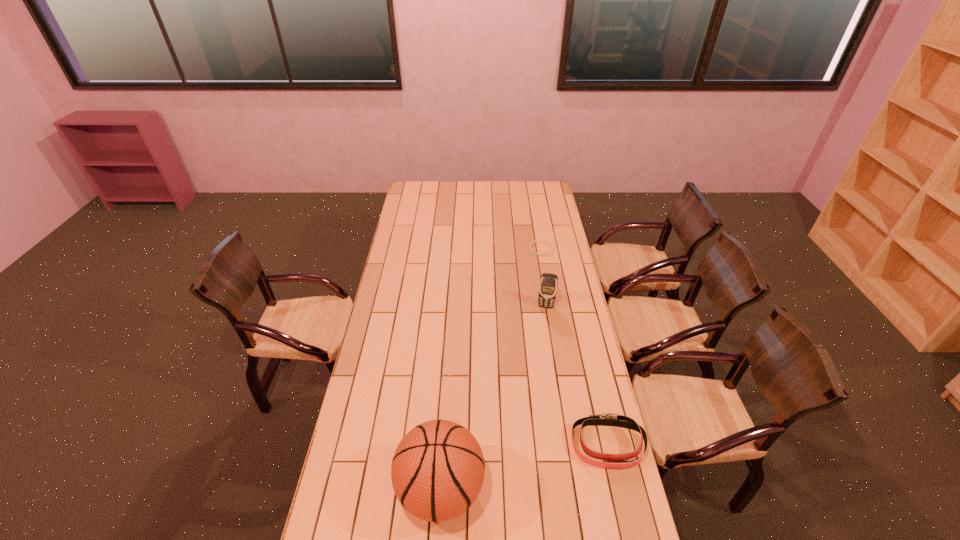
At what (x,y) coordinates should I click in order to perform the action: click on vacant space in between the basketball and the second shortest object. Please return your answer as a coordinate pair (x, y). Looking at the image, I should click on (524, 467).

This screenshot has height=540, width=960. Identify the location of vacant area that lies between the second tallest object and the tallest object. point(493,398).

Identify the location of free spot between the farthest object and the basketball. (492, 369).

Locate an element on the screen. object that is the closest to the bracelet is located at coordinates (548, 285).

Point out which object is positioned as the third nearest to the basketball. Please provide its 2D coordinates. Your answer should be formatted as a tuple, i.e. [(x, y)], where the tuple contains the x and y coordinates of a point satisfying the conditions above.

[(551, 245)]

Where is `free space that satisfies the following two spatial constraints: 1. on the front side of the dog collar; 2. on the right side of the bracelet`? free space that satisfies the following two spatial constraints: 1. on the front side of the dog collar; 2. on the right side of the bracelet is located at coordinates (575, 444).